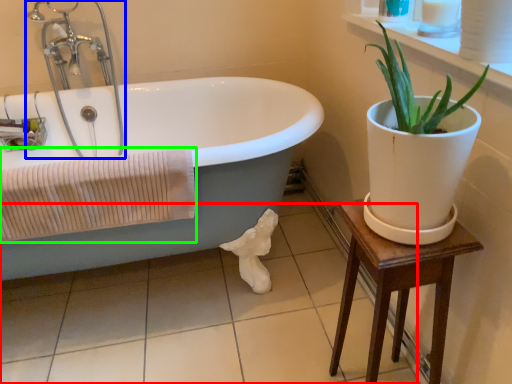
Question: Estimate the real-world distances between objects in this image. Which object is farther from tile (highlighted by a red box), faucet (highlighted by a blue box) or bath towel (highlighted by a green box)?

Choices:
 (A) faucet
 (B) bath towel

Answer: (A)